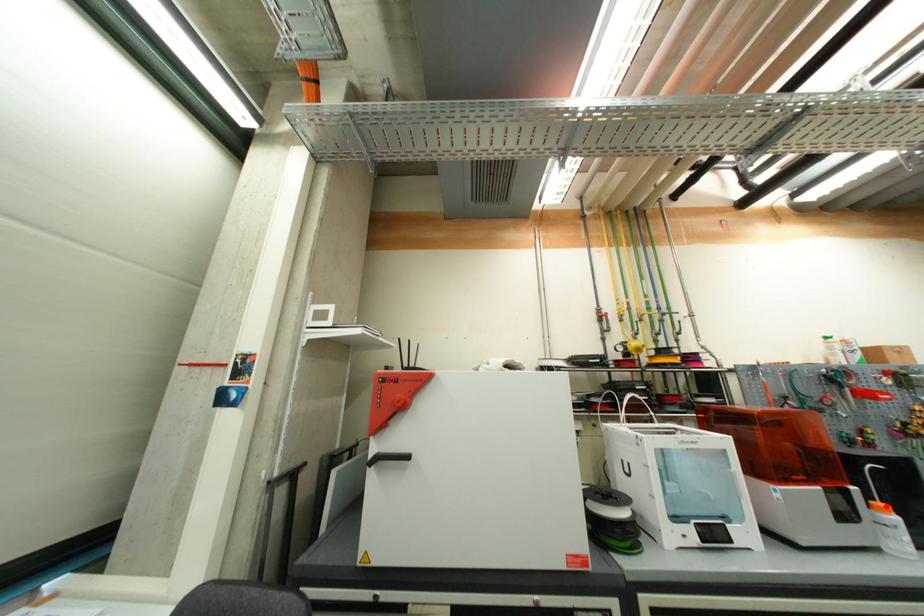
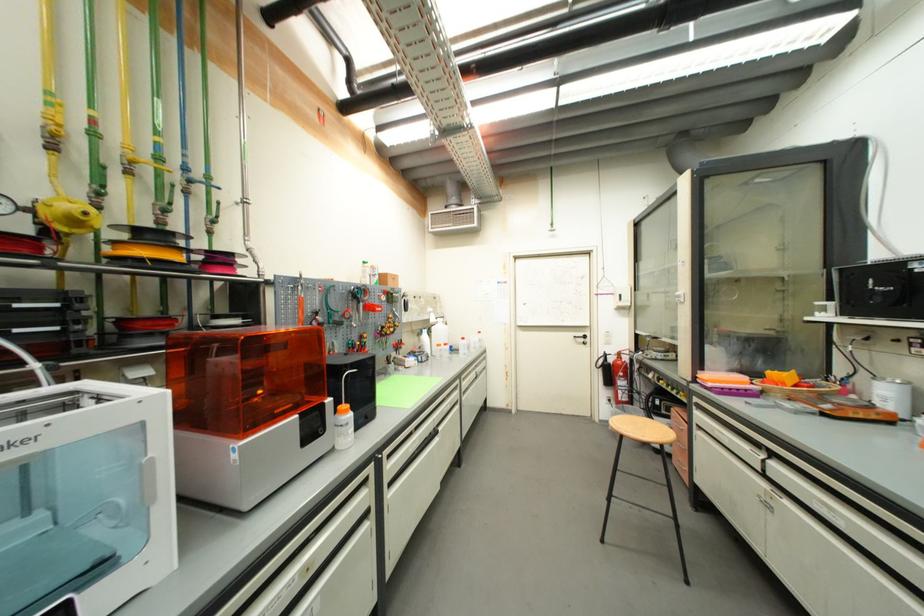
Locate, in the second image, the point that corresponds to the highlighted location in the first image.

(349, 408)